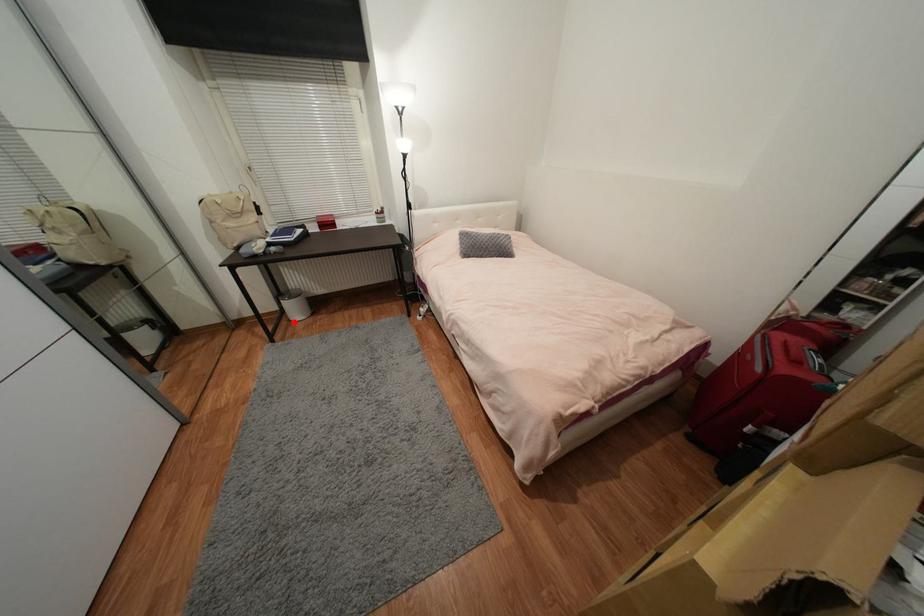
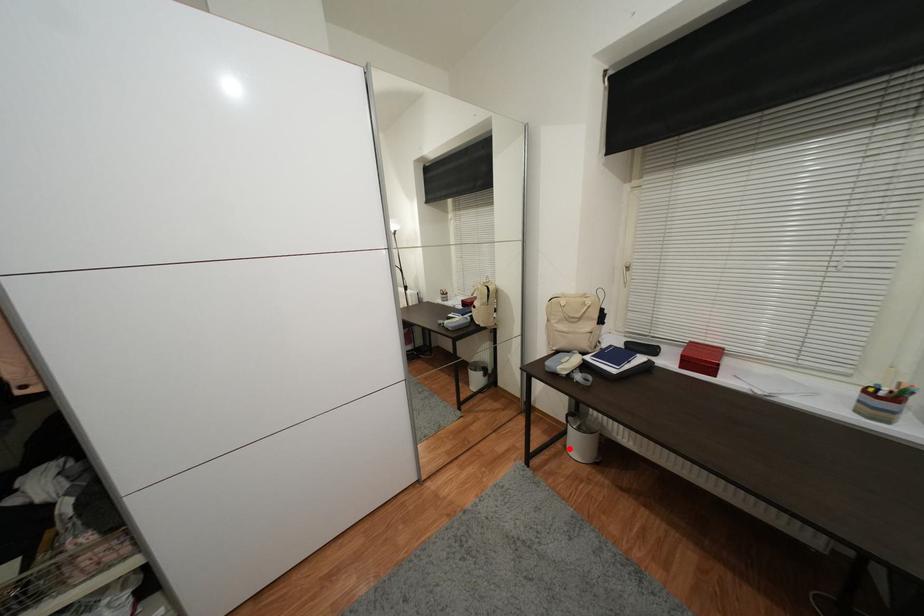
I am providing you with two images of the same scene from different viewpoints. A red point is marked on the first image and another point is marked on the second image. Is the red point in image1 aligned with the point shown in image2?

Yes